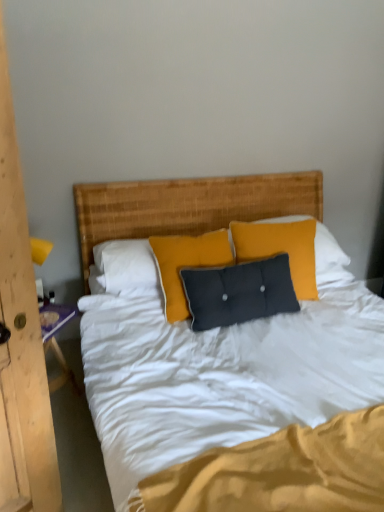
You are a GUI agent. You are given a task and a screenshot of the screen. Output one action in this format:
    pyautogui.click(x=<x>, y=<y>)
    Task: Click on the wooden nightstand at left
    This screenshot has width=384, height=512.
    Given the screenshot: What is the action you would take?
    pyautogui.click(x=55, y=339)

What do you see at coordinates (55, 339) in the screenshot? I see `wooden nightstand at left` at bounding box center [55, 339].

Based on the photo, in order to face velvet dark gray pillow at center, should I rotate leftwards or rightwards?

You should look right and rotate roughly 11.089 degrees.

The width and height of the screenshot is (384, 512). What do you see at coordinates (281, 249) in the screenshot?
I see `velvet dark gray pillow at center` at bounding box center [281, 249].

Where is `velvet dark gray pillow at center`? This screenshot has height=512, width=384. velvet dark gray pillow at center is located at coordinates (281, 249).

What is the approximate width of velvet dark gray pillow at center?

11.86 inches.

The width and height of the screenshot is (384, 512). I want to click on wooden nightstand at left, so click(55, 339).

Considering the positions of objects wooden nightstand at left and velvet dark gray pillow at center in the image provided, who is more to the left, wooden nightstand at left or velvet dark gray pillow at center?

From the viewer's perspective, wooden nightstand at left appears more on the left side.

Does wooden nightstand at left lie behind velvet dark gray pillow at center?

No, wooden nightstand at left is closer to the camera.

Is point (72, 380) behind point (276, 224)?

No, (72, 380) is in front of (276, 224).

From the image's perspective, is wooden nightstand at left located beneath velvet dark gray pillow at center?

Yes, from the image's perspective, wooden nightstand at left is beneath velvet dark gray pillow at center.

From a real-world perspective, is wooden nightstand at left positioned above or below velvet dark gray pillow at center?

wooden nightstand at left is situated lower than velvet dark gray pillow at center in the real world.

Which object is thinner, wooden nightstand at left or velvet dark gray pillow at center?

velvet dark gray pillow at center is thinner.

From their relative heights in the image, would you say wooden nightstand at left is taller or shorter than velvet dark gray pillow at center?

Considering their sizes, wooden nightstand at left has less height than velvet dark gray pillow at center.

Is wooden nightstand at left smaller than velvet dark gray pillow at center?

Correct, wooden nightstand at left occupies less space than velvet dark gray pillow at center.

Is wooden nightstand at left inside or outside of velvet dark gray pillow at center?

wooden nightstand at left is spatially situated outside velvet dark gray pillow at center.

Is wooden nightstand at left not close to velvet dark gray pillow at center?

That's right, there is a large distance between wooden nightstand at left and velvet dark gray pillow at center.

Is wooden nightstand at left oriented towards velvet dark gray pillow at center?

No, wooden nightstand at left is not facing towards velvet dark gray pillow at center.

How many degrees apart are the facing directions of wooden nightstand at left and velvet dark gray pillow at center?

wooden nightstand at left and velvet dark gray pillow at center are facing 24 degrees away from each other.

Measure the distance between wooden nightstand at left and velvet dark gray pillow at center.

wooden nightstand at left and velvet dark gray pillow at center are 1.03 meters apart.

In order to click on pillow that is behind the wooden nightstand at left in this screenshot , I will do `click(281, 249)`.

Considering the positions of objects velvet dark gray pillow at center and wooden nightstand at left in the image provided, who is more to the right, velvet dark gray pillow at center or wooden nightstand at left?

velvet dark gray pillow at center is more to the right.

In the scene shown: Is the position of velvet dark gray pillow at center more distant than that of wooden nightstand at left?

Yes, it is.

Is point (298, 251) farther from camera compared to point (69, 369)?

No.

From the image's perspective, is velvet dark gray pillow at center on top of wooden nightstand at left?

Yes, from the image's perspective, velvet dark gray pillow at center is over wooden nightstand at left.

Looking at this image, from a real-world perspective, which object stands above the other?

velvet dark gray pillow at center.

Is velvet dark gray pillow at center wider than wooden nightstand at left?

Incorrect, the width of velvet dark gray pillow at center does not surpass that of wooden nightstand at left.

Can you confirm if velvet dark gray pillow at center is shorter than wooden nightstand at left?

No.

Who is smaller, velvet dark gray pillow at center or wooden nightstand at left?

Smaller between the two is wooden nightstand at left.

Is velvet dark gray pillow at center outside of wooden nightstand at left?

Absolutely, velvet dark gray pillow at center is external to wooden nightstand at left.

Is the surface of velvet dark gray pillow at center in direct contact with wooden nightstand at left?

No, velvet dark gray pillow at center is not making contact with wooden nightstand at left.

Is wooden nightstand at left at the back of velvet dark gray pillow at center?

No, velvet dark gray pillow at center is not facing the opposite direction of wooden nightstand at left.

Can you tell me how much velvet dark gray pillow at center and wooden nightstand at left differ in facing direction?

The angular difference between velvet dark gray pillow at center and wooden nightstand at left is 24 degrees.

Measure the distance from velvet dark gray pillow at center to wooden nightstand at left.

velvet dark gray pillow at center and wooden nightstand at left are 1.03 meters apart.

Where is `nightstand below the velvet dark gray pillow at center (from a real-world perspective)`? The image size is (384, 512). nightstand below the velvet dark gray pillow at center (from a real-world perspective) is located at coordinates (55, 339).

Image resolution: width=384 pixels, height=512 pixels. What are the coordinates of `nightstand below the velvet dark gray pillow at center (from the image's perspective)` in the screenshot? It's located at (55, 339).

Where is `pillow above the wooden nightstand at left (from a real-world perspective)`? This screenshot has width=384, height=512. pillow above the wooden nightstand at left (from a real-world perspective) is located at coordinates (281, 249).